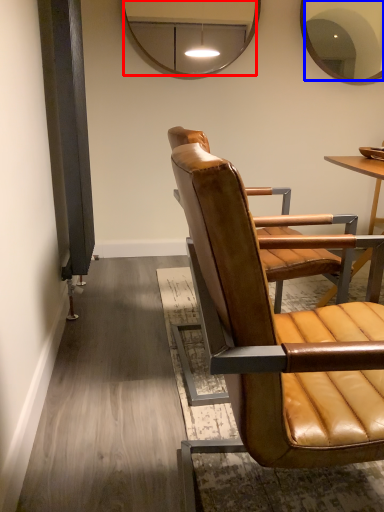
Question: Among these objects, which one is farthest to the camera, mirror (highlighted by a red box) or mirror (highlighted by a blue box)?

Choices:
 (A) mirror
 (B) mirror

Answer: (B)